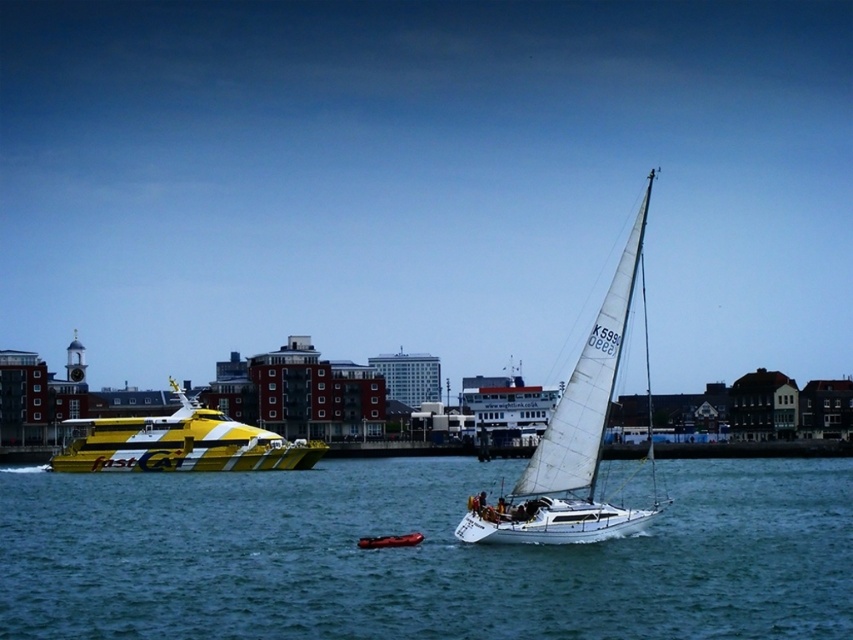
Who is shorter, white sailboat at center or yellow striped catamaran at left?

yellow striped catamaran at left

Is the position of white sailboat at center more distant than that of yellow striped catamaran at left?

No, white sailboat at center is in front of yellow striped catamaran at left.

Is point (548, 525) less distant than point (80, 449)?

Yes, point (548, 525) is in front of point (80, 449).

The width and height of the screenshot is (853, 640). In order to click on white sailboat at center in this screenshot , I will do `click(573, 438)`.

Describe the element at coordinates (418, 556) in the screenshot. I see `blue water at center` at that location.

Consider the image. Is blue water at center taller than yellow striped catamaran at left?

Incorrect, blue water at center's height is not larger of yellow striped catamaran at left's.

This screenshot has height=640, width=853. What are the coordinates of `blue water at center` in the screenshot? It's located at (418, 556).

This screenshot has height=640, width=853. Identify the location of blue water at center. (418, 556).

How distant is blue water at center from white sailboat at center?

blue water at center is 29.13 meters from white sailboat at center.

Is point (671, 476) positioned after point (648, 177)?

No.

What do you see at coordinates (418, 556) in the screenshot? This screenshot has width=853, height=640. I see `blue water at center` at bounding box center [418, 556].

Locate an element on the screen. This screenshot has width=853, height=640. blue water at center is located at coordinates (418, 556).